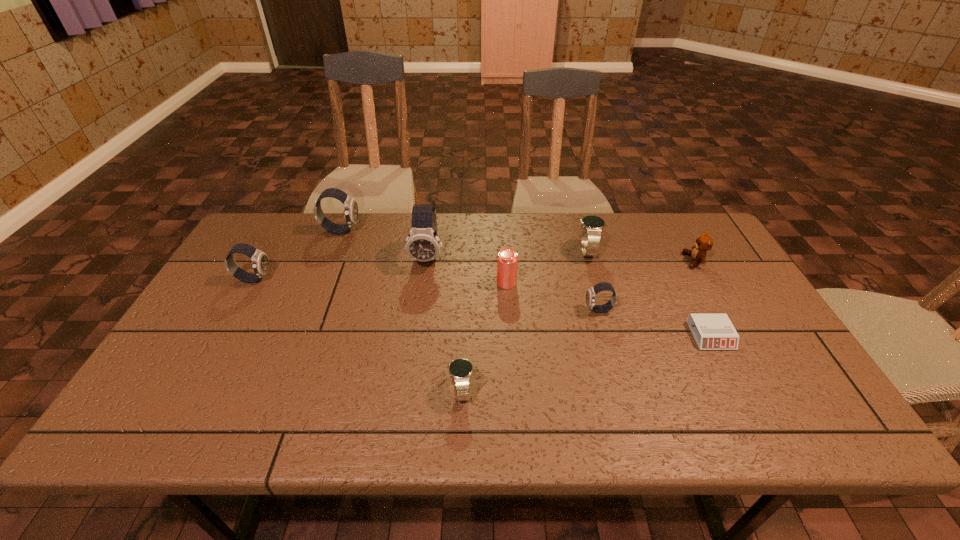
Identify the location of the biggest dark watch. (423, 244).

The image size is (960, 540). What are the coordinates of `the seventh object from right to left` in the screenshot? It's located at (423, 244).

Where is `the eighth object from right to left`? The width and height of the screenshot is (960, 540). the eighth object from right to left is located at coordinates (350, 205).

Where is `the second tallest watch`? The image size is (960, 540). the second tallest watch is located at coordinates (350, 205).

Where is `the leftmost watch`? This screenshot has width=960, height=540. the leftmost watch is located at coordinates (260, 262).

Where is `the leftmost object`? the leftmost object is located at coordinates (260, 262).

Find the location of a particular element. The image size is (960, 540). the farther blue watch is located at coordinates (592, 226).

Image resolution: width=960 pixels, height=540 pixels. What are the coordinates of `the right blue watch` in the screenshot? It's located at pos(592,226).

At what (x,y) coordinates should I click in order to perform the action: click on beer can. Please return your answer as a coordinate pair (x, y). Looking at the image, I should click on (507, 260).

In order to click on teddy bear in this screenshot , I will do `click(704, 243)`.